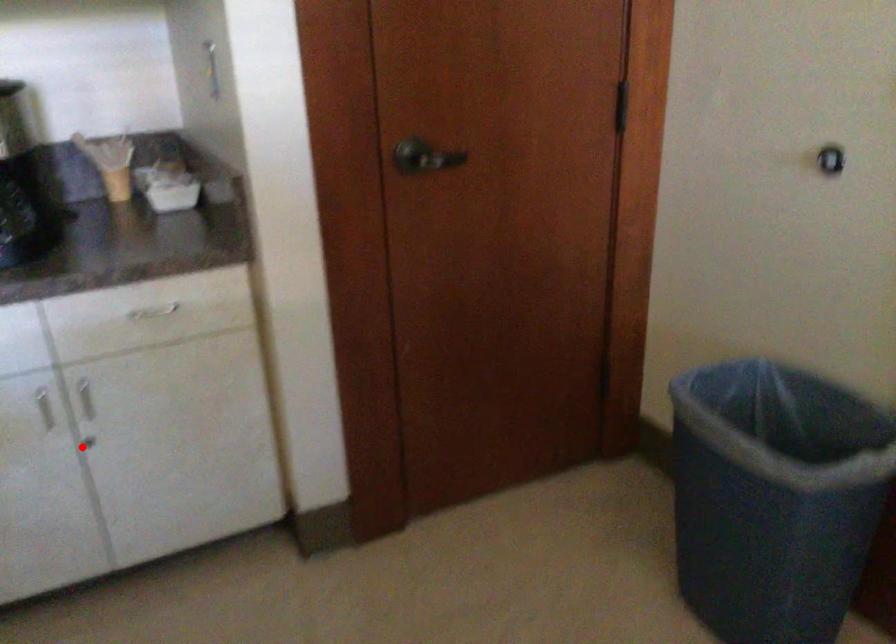
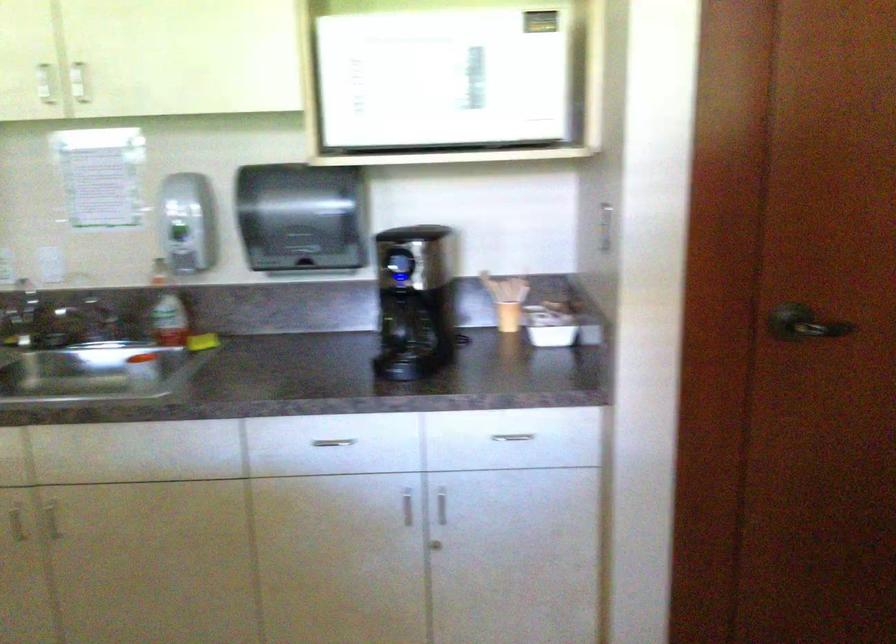
Question: I am providing you with two images of the same scene from different viewpoints. Image1 has a red point marked. In image2, the corresponding 3D location appears at what relative position? Reply with the corresponding letter.

Choices:
 (A) Closer
 (B) Farther

Answer: (B)